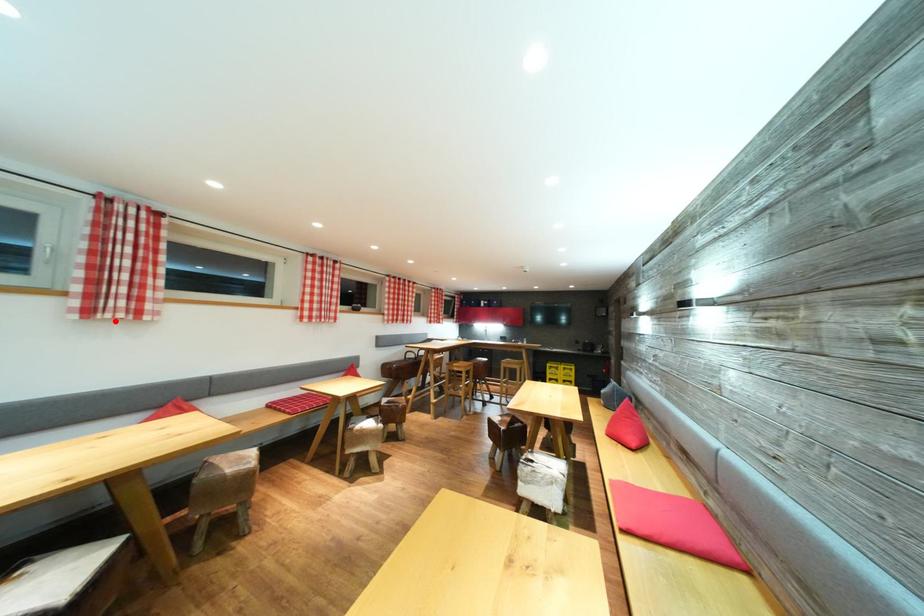
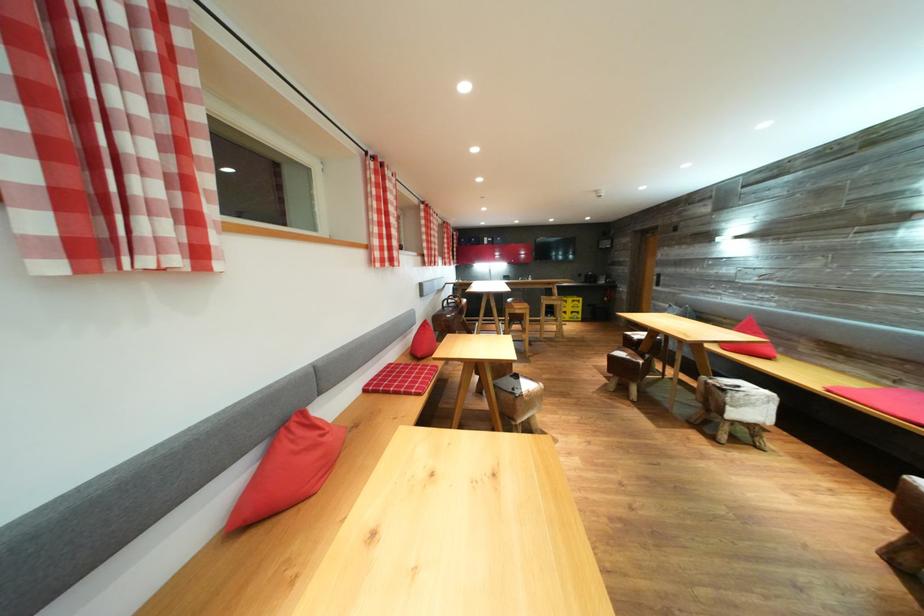
Find the pixel in the second image that matches the highlighted location in the first image.

(153, 267)